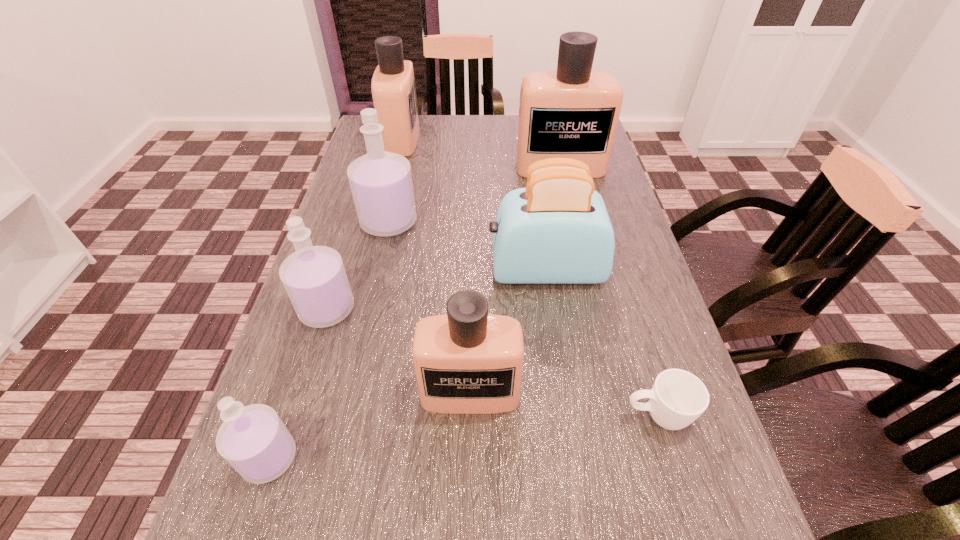
Find the location of a particular element. vacant area situated 0.190m on the front label of the third farthest beige perfume is located at coordinates (468, 538).

Where is `vacant space located 0.140m on the back of the second nearest perfume`? vacant space located 0.140m on the back of the second nearest perfume is located at coordinates (301, 361).

Find the location of a particular element. free point located 0.280m with the handle on the side of the shortest object is located at coordinates (462, 416).

Locate an element on the screen. blank area located with the handle on the side of the shortest object is located at coordinates (468, 416).

The image size is (960, 540). What are the coordinates of `vacant region located with the handle on the side of the shortest object` in the screenshot? It's located at (462, 416).

This screenshot has width=960, height=540. What are the coordinates of `object that is at the far edge` in the screenshot? It's located at (393, 87).

In order to click on perfume that is at the right edge in this screenshot , I will do `click(572, 112)`.

The image size is (960, 540). Find the location of `toaster present at the right edge`. toaster present at the right edge is located at coordinates (557, 230).

This screenshot has width=960, height=540. I want to click on cup present at the right edge, so click(678, 398).

I want to click on object situated at the far left corner, so click(393, 87).